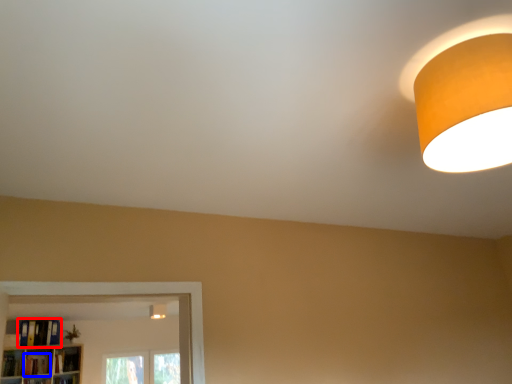
Question: Which point is closer to the camera, book (highlighted by a red box) or book (highlighted by a blue box)?

Choices:
 (A) book
 (B) book

Answer: (A)